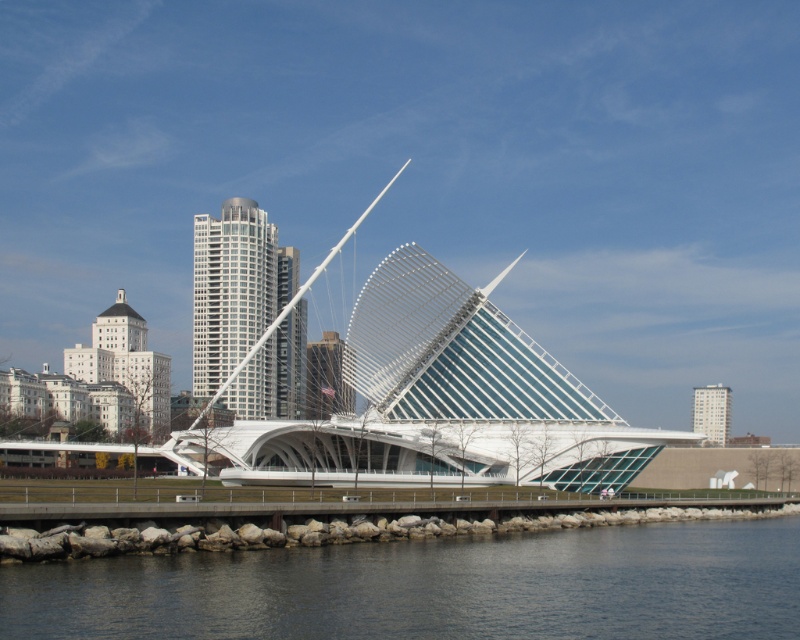
Question: Is dark blue water at lower center thinner than white glass pedestrian bridge at center?

Choices:
 (A) no
 (B) yes

Answer: (A)

Question: Can you confirm if dark blue water at lower center is wider than white glass pedestrian bridge at center?

Choices:
 (A) yes
 (B) no

Answer: (A)

Question: Can you confirm if dark blue water at lower center is positioned to the right of white glass pedestrian bridge at center?

Choices:
 (A) no
 (B) yes

Answer: (B)

Question: Which point is farther to the camera?

Choices:
 (A) white glass pedestrian bridge at center
 (B) dark blue water at lower center

Answer: (A)